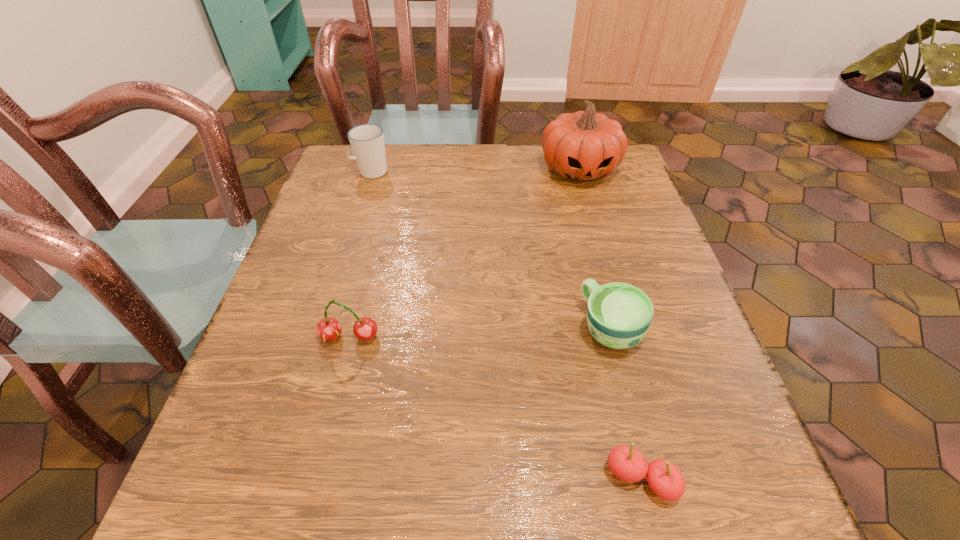
I want to click on vacant space located 0.190m with stems pointing upwards on the farther cherry, so click(319, 461).

Image resolution: width=960 pixels, height=540 pixels. Identify the location of vacant space situated on the left of the shorter cup. (354, 328).

I want to click on vacant space located on the left of the nearest object, so click(x=444, y=480).

In order to click on pumpkin that is at the far edge in this screenshot , I will do `click(584, 146)`.

Where is `cup at the far edge`? This screenshot has width=960, height=540. cup at the far edge is located at coordinates (367, 141).

I want to click on object that is at the near edge, so click(628, 464).

Locate an element on the screen. cup located at the left edge is located at coordinates (367, 141).

At what (x,y) coordinates should I click in order to perform the action: click on cherry located at the left edge. Please return your answer as a coordinate pair (x, y). Image resolution: width=960 pixels, height=540 pixels. Looking at the image, I should click on (328, 329).

Where is `pumpkin at the right edge`? The image size is (960, 540). pumpkin at the right edge is located at coordinates (584, 146).

Where is `cup positioned at the right edge`? Image resolution: width=960 pixels, height=540 pixels. cup positioned at the right edge is located at coordinates (619, 315).